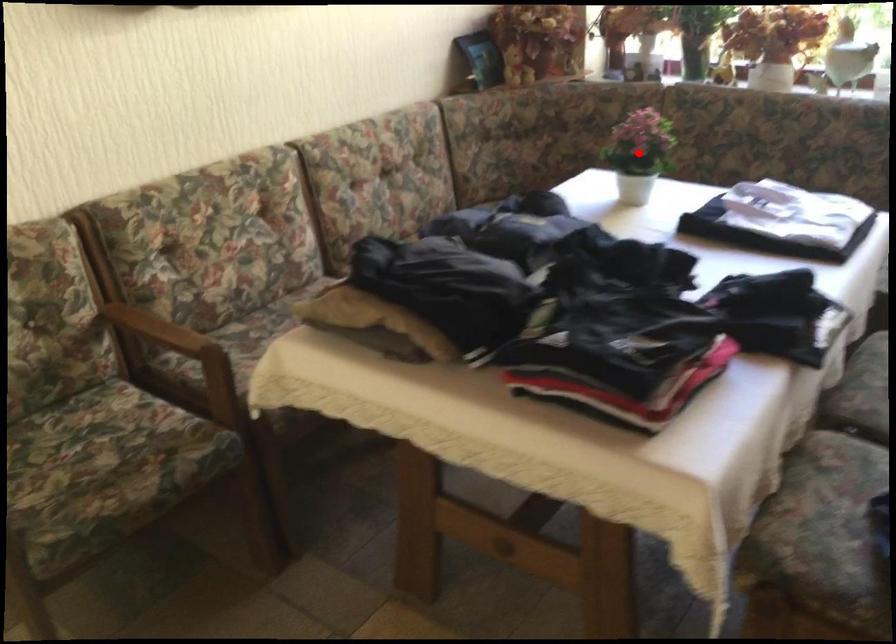
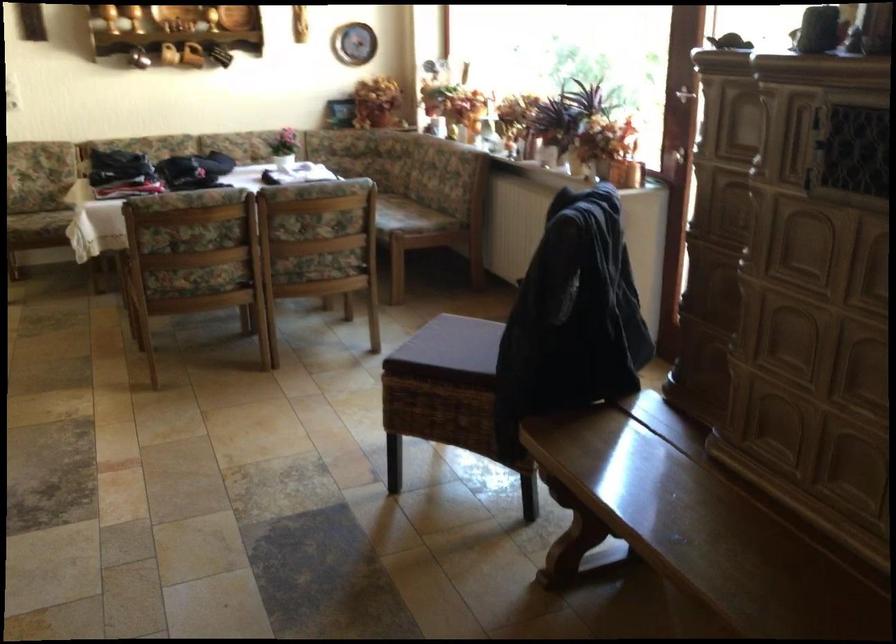
Question: I am providing you with two images of the same scene from different viewpoints. A red point is marked on the first image. Can you still see the location of the red point in image 2?

Choices:
 (A) Yes
 (B) No

Answer: (B)